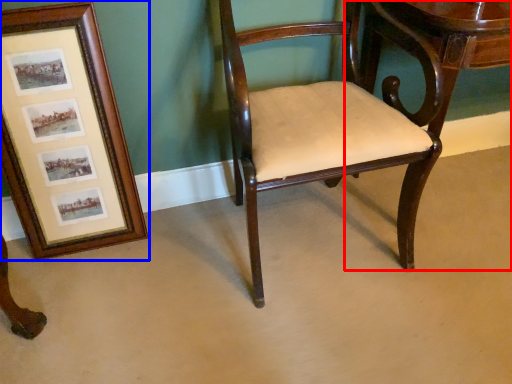
Question: Which point is further to the camera, table (highlighted by a red box) or picture frame (highlighted by a blue box)?

Choices:
 (A) table
 (B) picture frame

Answer: (A)